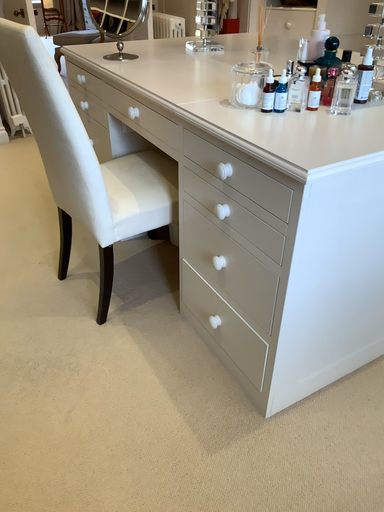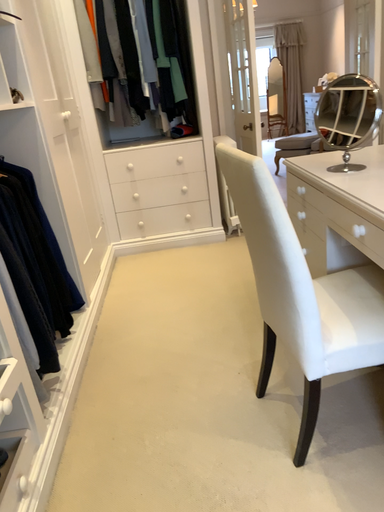
Question: Which way did the camera rotate in the video?

Choices:
 (A) rotated right
 (B) rotated left

Answer: (B)